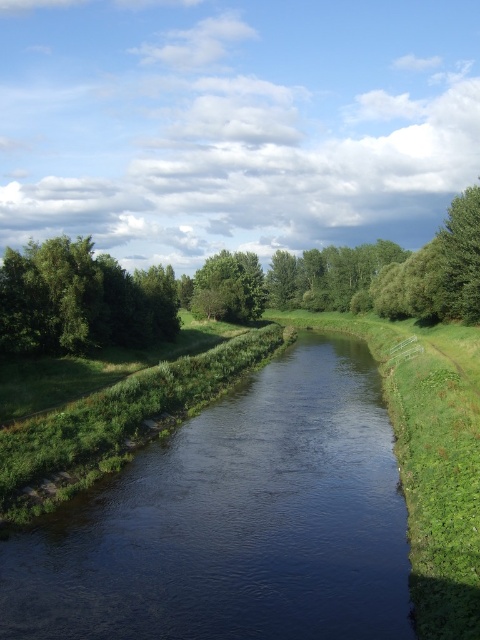
You are a hiker standing on the path near the green leafy tree at left and the green leafy tree at center. Which tree has a wider spread of branches?

The green leafy tree at center has a wider spread of branches than the green leafy tree at left.

Looking at this image, you are standing on the path near the river and want to take a photo of the dark water at center and the green leafy tree at left. Which object should you focus on first to ensure both are in clear view?

You should focus on the dark water at center first since it is closer to you than the green leafy tree at left, ensuring both are in clear focus when taking the photo.